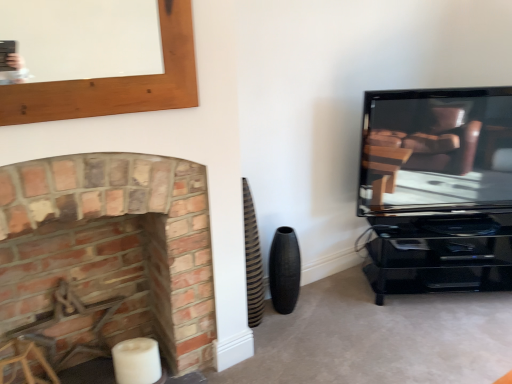
At what (x,y) coordinates should I click in order to perform the action: click on free point below black textured vase at lower center (from a real-world perspective). Please return your answer as a coordinate pair (x, y). The width and height of the screenshot is (512, 384). Looking at the image, I should click on (285, 317).